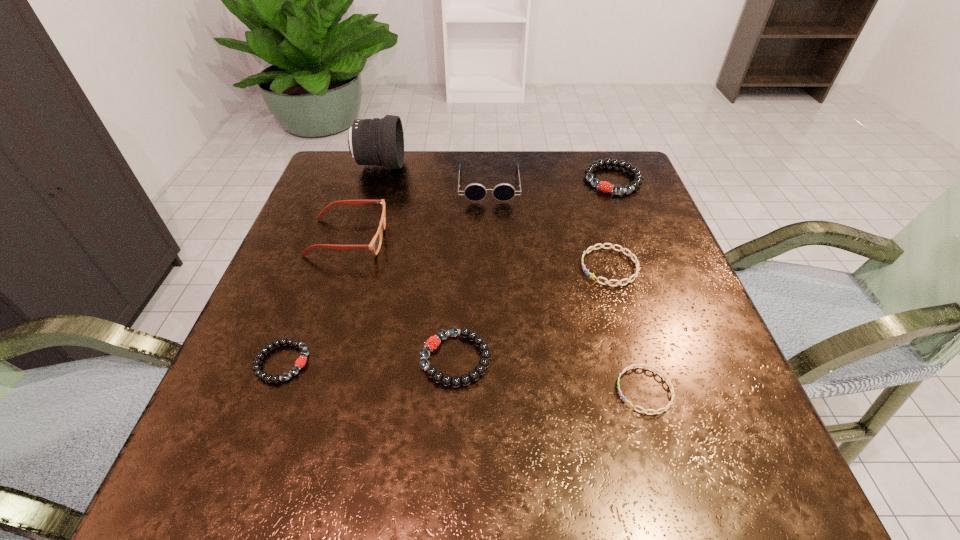
Identify the location of the fifth closest object to the second tallest bracelet. (475, 192).

Where is `the fourth closest bracelet to the telephoto lens`? The image size is (960, 540). the fourth closest bracelet to the telephoto lens is located at coordinates (301, 361).

Select which bracelet appears as the second closest to the spectacles. Please provide its 2D coordinates. Your answer should be formatted as a tuple, i.e. [(x, y)], where the tuple contains the x and y coordinates of a point satisfying the conditions above.

[(433, 342)]

Where is `black bracelet that can be found as the second closest to the smaller blue bracelet`? The image size is (960, 540). black bracelet that can be found as the second closest to the smaller blue bracelet is located at coordinates (604, 186).

Choose which black bracelet is the second nearest neighbor to the farthest black bracelet. Please provide its 2D coordinates. Your answer should be formatted as a tuple, i.e. [(x, y)], where the tuple contains the x and y coordinates of a point satisfying the conditions above.

[(301, 361)]

This screenshot has width=960, height=540. Find the location of `free space that satisfies the following two spatial constraints: 1. at the front element of the telephoto lens; 2. on the right side of the second biggest black bracelet`. free space that satisfies the following two spatial constraints: 1. at the front element of the telephoto lens; 2. on the right side of the second biggest black bracelet is located at coordinates (322, 359).